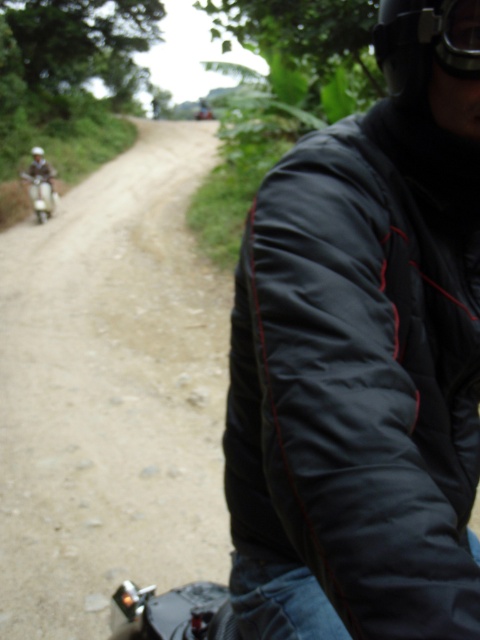
Who is more distant from viewer, (152, 298) or (34, 161)?

The point (34, 161) is behind.

Locate an element on the screen. dusty gravel road at center is located at coordinates (111, 392).

Between point (288, 259) and point (455, 24), which one is positioned behind?

The point (455, 24) is more distant.

Does black puffy jacket at right appear over black matte goggles at upper right?

Actually, black puffy jacket at right is below black matte goggles at upper right.

Describe the element at coordinates (359, 381) in the screenshot. The height and width of the screenshot is (640, 480). I see `black puffy jacket at right` at that location.

This screenshot has height=640, width=480. What are the coordinates of `black puffy jacket at right` in the screenshot? It's located at (359, 381).

In the scene shown: Can you confirm if black puffy jacket at right is positioned to the right of matte white scooter at left?

Yes, black puffy jacket at right is to the right of matte white scooter at left.

Is point (437, 296) positioned before point (48, 177)?

Yes.

You are a GUI agent. You are given a task and a screenshot of the screen. Output one action in this format:
    pyautogui.click(x=<x>, y=<y>)
    Task: Click on the black puffy jacket at right
    
    Given the screenshot: What is the action you would take?
    pyautogui.click(x=359, y=381)